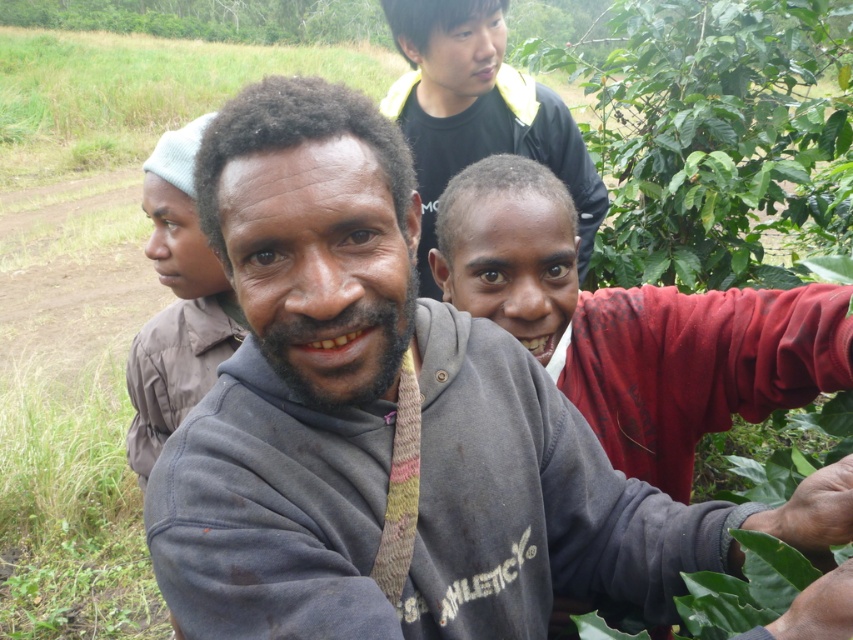
You are a photographer trying to capture both the gray sweatshirt at center and the brown cotton shirt at center in a single frame. Given their sizes, which one should you focus on to ensure both are visible without cropping?

Since the gray sweatshirt at center is smaller than the brown cotton shirt at center, you should focus on the brown cotton shirt at center to ensure both are visible without cropping.

Based on the scene described, which object is closer to the viewer between the gray cotton hoodie at lower right and the black matte shirt at upper center?

The gray cotton hoodie at lower right is closer to the viewer because it is in front of the black matte shirt at upper center.

Where is the gray cotton hoodie at lower right positioned in the image?

The gray cotton hoodie at lower right is positioned at point [630,324].